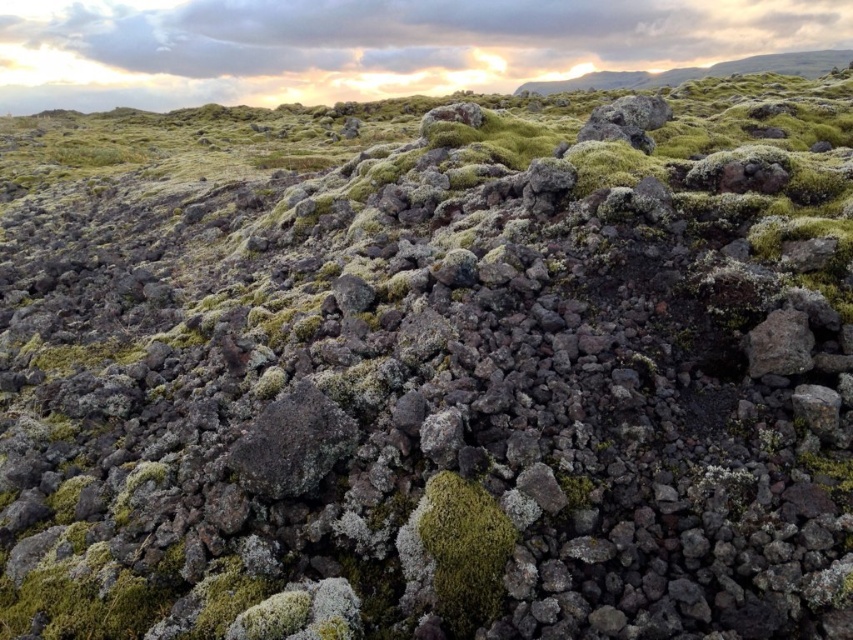
Does green mossy rock at center have a lesser height compared to dark gray rock at center?

Incorrect, green mossy rock at center's height does not fall short of dark gray rock at center's.

Is green mossy rock at center behind dark gray rock at center?

No, it is in front of dark gray rock at center.

Where is `green mossy rock at center`? green mossy rock at center is located at coordinates 463,550.

Is green mossy rock at center below gray rough rock at right?

Correct, green mossy rock at center is located below gray rough rock at right.

Between green mossy rock at center and gray rough rock at right, which one has more height?

Standing taller between the two is green mossy rock at center.

Who is more distant from viewer, (x=440, y=582) or (x=785, y=310)?

The point (x=785, y=310) is behind.

The image size is (853, 640). What are the coordinates of `green mossy rock at center` in the screenshot? It's located at (463, 550).

Between dark gray rock at center and gray rough rock at right, which one is positioned higher?

gray rough rock at right is higher up.

Is dark gray rock at center thinner than gray rough rock at right?

No.

The image size is (853, 640). Find the location of `dark gray rock at center`. dark gray rock at center is located at coordinates (292, 444).

You are a GUI agent. You are given a task and a screenshot of the screen. Output one action in this format:
    pyautogui.click(x=<x>, y=<y>)
    Task: Click on the dark gray rock at center
    
    Given the screenshot: What is the action you would take?
    pyautogui.click(x=292, y=444)